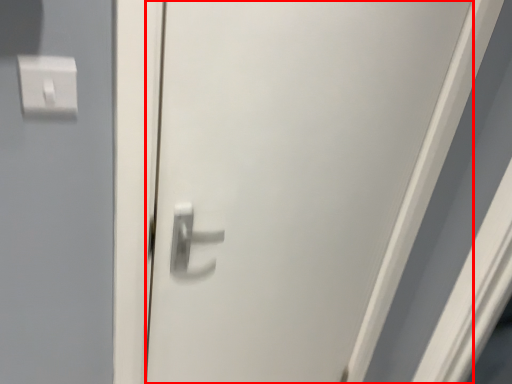
Question: Considering the relative positions of door (annotated by the red box) and light switch in the image provided, where is door (annotated by the red box) located with respect to the staircase?

Choices:
 (A) left
 (B) right

Answer: (B)